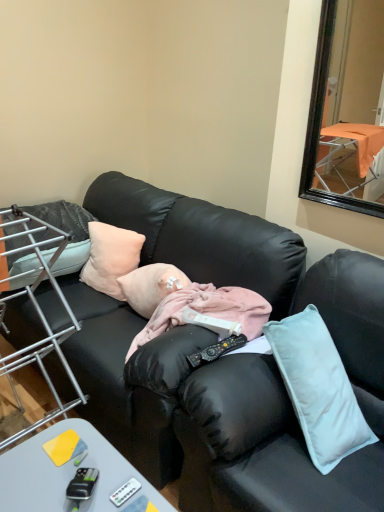
Question: From a real-world perspective, is black plastic remote control at center, the 1th remote control positioned from the back, under soft pink pillow at left, the 2th pillow from the right?

Choices:
 (A) no
 (B) yes

Answer: (B)

Question: Is black plastic remote control at center, which is counted as the second remote control, starting from the front, turned away from soft pink pillow at left, the 2th pillow from the right?

Choices:
 (A) yes
 (B) no

Answer: (B)

Question: Considering the relative sizes of black plastic remote control at center, which is counted as the second remote control, starting from the front, and soft pink pillow at left, the 2th pillow from the right, in the image provided, is black plastic remote control at center, which is counted as the second remote control, starting from the front, taller than soft pink pillow at left, the 2th pillow from the right,?

Choices:
 (A) yes
 (B) no

Answer: (B)

Question: Is black plastic remote control at center, which is the first remote control from right to left, oriented towards soft pink pillow at left, arranged as the first pillow when viewed from the left?

Choices:
 (A) yes
 (B) no

Answer: (B)

Question: Is black plastic remote control at center, marked as the 2th remote control in a left-to-right arrangement, to the right of soft pink pillow at left, the 2th pillow from the right, from the viewer's perspective?

Choices:
 (A) yes
 (B) no

Answer: (A)

Question: Considering their positions, is metal wire rack at left located in front of or behind peach fabric pillow at center, which appears as the 2th pillow when viewed from the left?

Choices:
 (A) behind
 (B) front

Answer: (B)

Question: Considering the positions of metal wire rack at left and peach fabric pillow at center, which appears as the 1th pillow when viewed from the right, in the image, is metal wire rack at left wider or thinner than peach fabric pillow at center, which appears as the 1th pillow when viewed from the right,?

Choices:
 (A) wide
 (B) thin

Answer: (A)

Question: Is metal wire rack at left to the left or to the right of peach fabric pillow at center, which appears as the 2th pillow when viewed from the left, in the image?

Choices:
 (A) left
 (B) right

Answer: (A)

Question: Is metal wire rack at left taller or shorter than peach fabric pillow at center, which appears as the 2th pillow when viewed from the left?

Choices:
 (A) tall
 (B) short

Answer: (A)

Question: Is gray plastic desk at lower left to the left or to the right of pink fabric at center, arranged as the first person when viewed from the front, in the image?

Choices:
 (A) left
 (B) right

Answer: (A)

Question: From a real-world perspective, is gray plastic desk at lower left positioned above or below pink fabric at center, positioned as the 2th person in back-to-front order?

Choices:
 (A) below
 (B) above

Answer: (A)

Question: Considering the positions of gray plastic desk at lower left and pink fabric at center, arranged as the first person when viewed from the front, in the image, is gray plastic desk at lower left bigger or smaller than pink fabric at center, arranged as the first person when viewed from the front,?

Choices:
 (A) small
 (B) big

Answer: (B)

Question: Considering the positions of gray plastic desk at lower left and pink fabric at center, positioned as the 2th person in back-to-front order, in the image, is gray plastic desk at lower left taller or shorter than pink fabric at center, positioned as the 2th person in back-to-front order,?

Choices:
 (A) short
 (B) tall

Answer: (B)

Question: In the image, is black plastic remote control at center, acting as the 1th remote control starting from the top, on the left side or the right side of white plastic remote control at lower center, arranged as the second remote control when viewed from the right?

Choices:
 (A) left
 (B) right

Answer: (B)

Question: From a real-world perspective, is black plastic remote control at center, the 1th remote control positioned from the back, positioned above or below white plastic remote control at lower center, arranged as the second remote control when viewed from the right?

Choices:
 (A) above
 (B) below

Answer: (A)